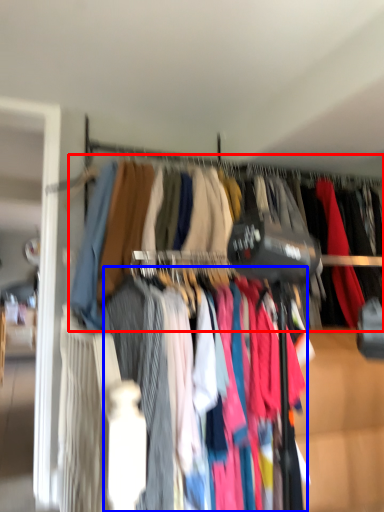
Question: Which of the following is the farthest to the observer, closet (highlighted by a red box) or clothing (highlighted by a blue box)?

Choices:
 (A) closet
 (B) clothing

Answer: (A)